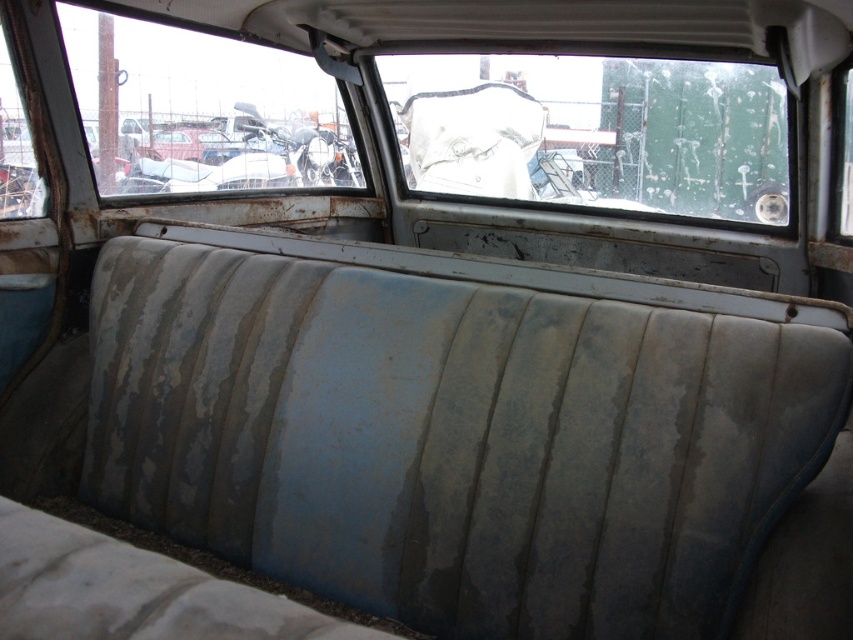
Which is more to the left, frosted glass windshield at upper center or transparent glass window at upper left?

Positioned to the left is transparent glass window at upper left.

How much distance is there between frosted glass windshield at upper center and transparent glass window at upper left?

frosted glass windshield at upper center is 1.59 meters from transparent glass window at upper left.

Describe the element at coordinates (595, 131) in the screenshot. Image resolution: width=853 pixels, height=640 pixels. I see `frosted glass windshield at upper center` at that location.

You are a GUI agent. You are given a task and a screenshot of the screen. Output one action in this format:
    pyautogui.click(x=<x>, y=<y>)
    Task: Click on the frosted glass windshield at upper center
    This screenshot has width=853, height=640.
    Given the screenshot: What is the action you would take?
    pyautogui.click(x=595, y=131)